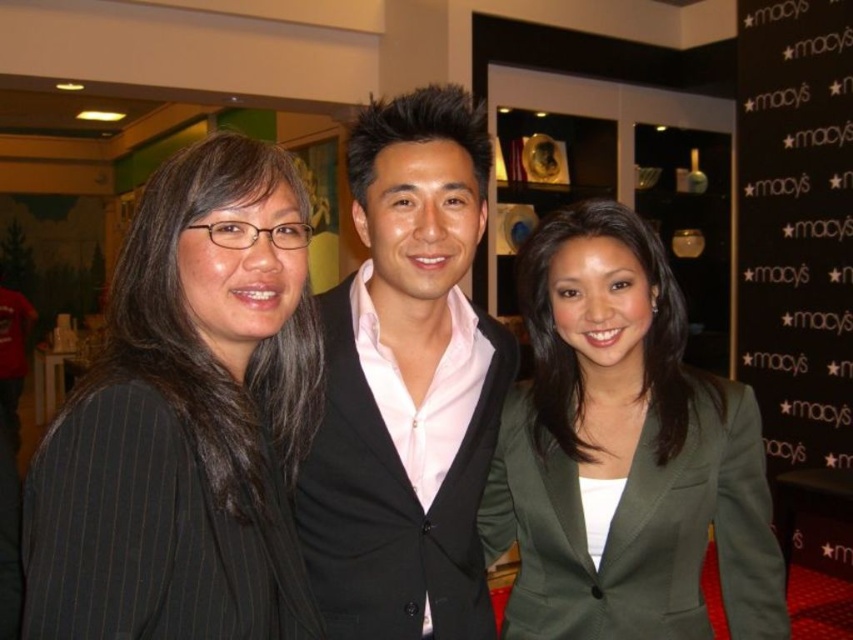
You are standing in front of the display case and want to hand a promotional item to the person wearing the black pinstripe blazer at left and the black fabric at right. Which one can you reach without moving closer to the group?

The black pinstripe blazer at left is closer to the viewer than the black fabric at right, so you can reach the person wearing the black pinstripe blazer at left without moving closer.

In the scene shown: You are a photographer setting up for a group photo. You notice the black pinstripe blazer at left and the green matte blazer at center. Which blazer is positioned higher in the image?

The black pinstripe blazer at left is positioned higher in the image than the green matte blazer at center because it is above it.